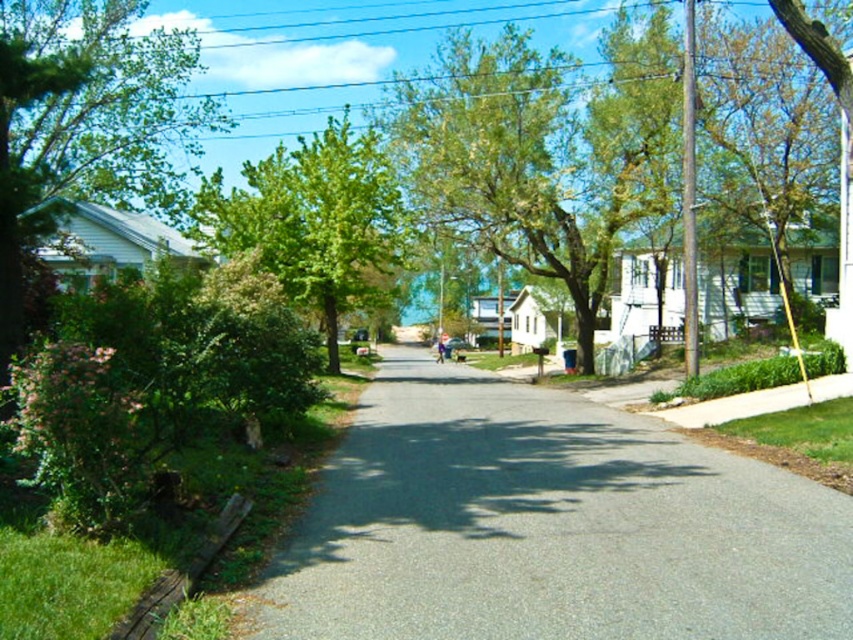
Question: Which of the following is the closest to the observer?

Choices:
 (A) green leafy tree at left
 (B) gray asphalt road at center
 (C) green leafy tree at center

Answer: (B)

Question: Is gray asphalt road at center smaller than green leafy tree at left?

Choices:
 (A) no
 (B) yes

Answer: (B)

Question: Does gray asphalt road at center come behind green leafy tree at left?

Choices:
 (A) no
 (B) yes

Answer: (A)

Question: Which of these objects is positioned closest to the green leafy tree at left?

Choices:
 (A) gray asphalt road at center
 (B) green leafy tree at center

Answer: (B)

Question: Does gray asphalt road at center come behind green leafy tree at center?

Choices:
 (A) yes
 (B) no

Answer: (B)

Question: Which object is positioned farthest from the green leafy tree at left?

Choices:
 (A) gray asphalt road at center
 (B) green leafy tree at center

Answer: (A)